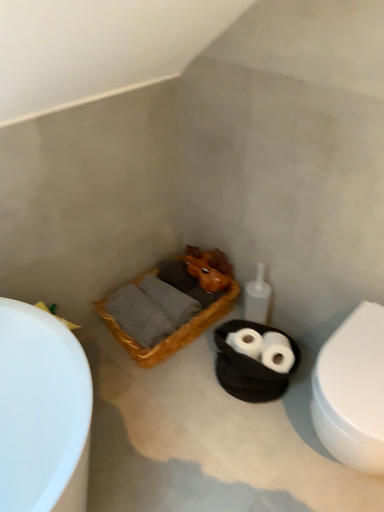
At what (x,y) coordinates should I click in order to perform the action: click on vacant region in front of black woven basket at center. Please return your answer as a coordinate pair (x, y). The image size is (384, 512). Looking at the image, I should click on (252, 434).